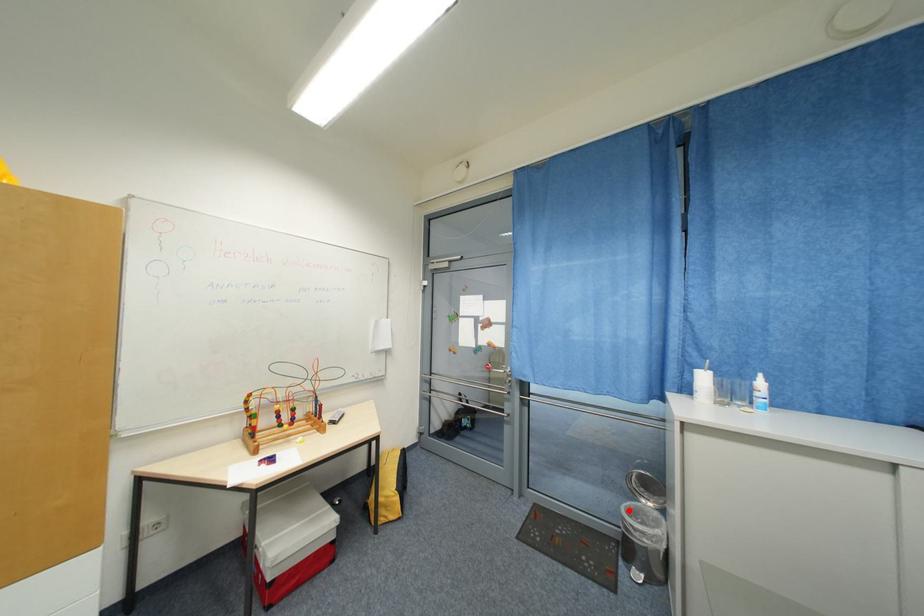
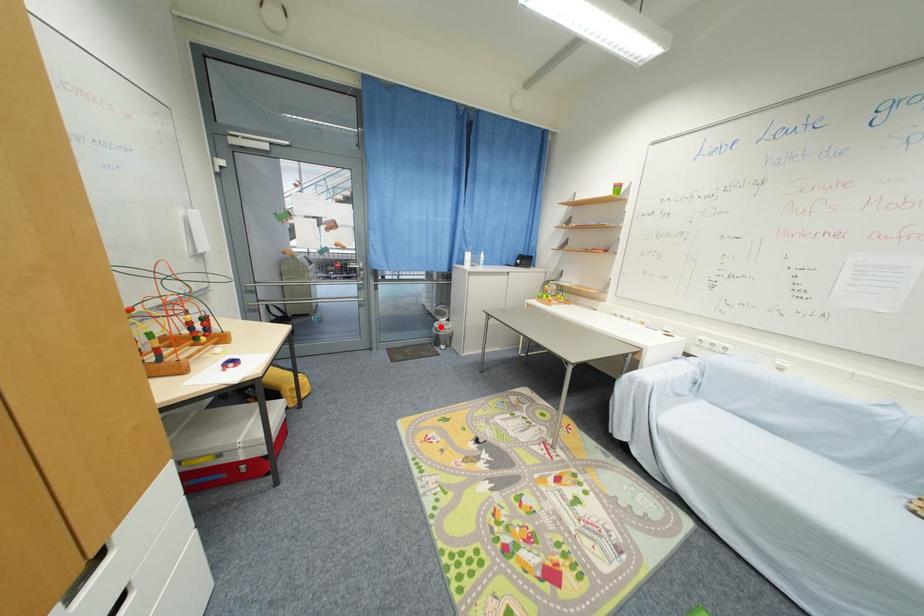
I am providing you with two images of the same scene from different viewpoints. A red point is marked on the first image and another point is marked on the second image. Are the points marked in image1 and image2 representing the same 3D position?

Yes